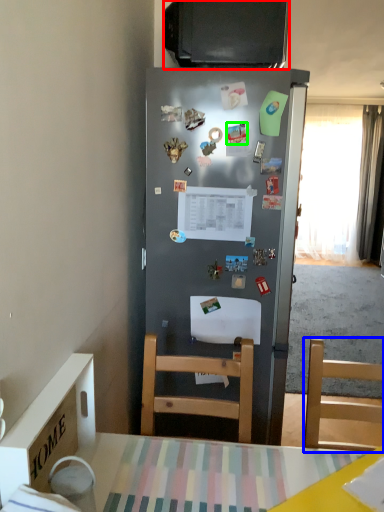
Question: Which object is the farthest from television (highlighted by a red box)? Choose among these: chair (highlighted by a blue box) or magnet (highlighted by a green box).

Choices:
 (A) chair
 (B) magnet

Answer: (A)